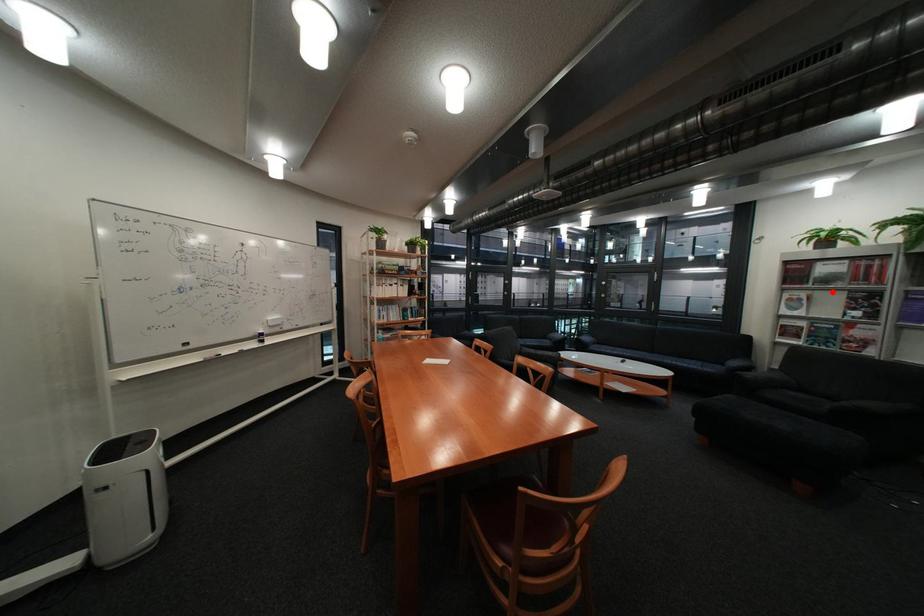
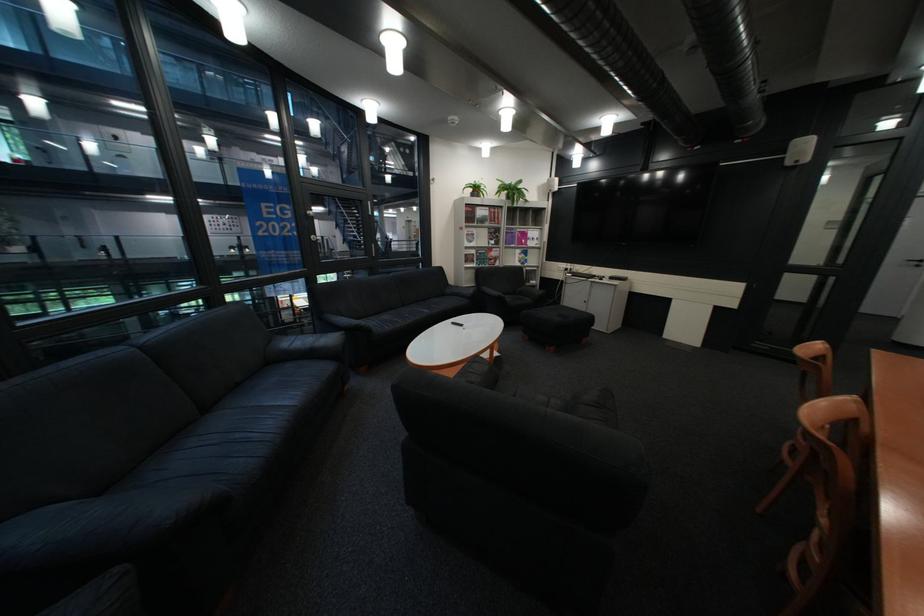
Question: I am providing you with two images of the same scene from different viewpoints. A red point is marked on the first image. At the location where the point appears in image 1, is it still visible in image 2?

Choices:
 (A) Yes
 (B) No

Answer: (A)